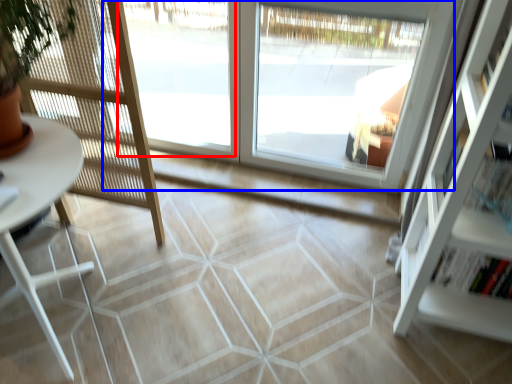
Question: Among these objects, which one is farthest to the camera, window (highlighted by a red box) or window (highlighted by a blue box)?

Choices:
 (A) window
 (B) window

Answer: (A)